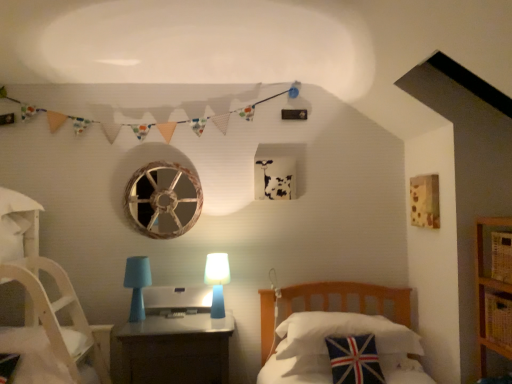
Question: Which direction should I rotate to look at blue matte table lamp at center, positioned as the 1th table lamp in right-to-left order?

Choices:
 (A) left
 (B) right

Answer: (A)

Question: Is matte plastic nightstand at center thinner than yellow woven basket at lower right?

Choices:
 (A) yes
 (B) no

Answer: (B)

Question: Is matte plastic nightstand at center positioned behind yellow woven basket at lower right?

Choices:
 (A) yes
 (B) no

Answer: (A)

Question: Considering the relative sizes of matte plastic nightstand at center and yellow woven basket at lower right in the image provided, is matte plastic nightstand at center shorter than yellow woven basket at lower right?

Choices:
 (A) no
 (B) yes

Answer: (A)

Question: From the image's perspective, is matte plastic nightstand at center over yellow woven basket at lower right?

Choices:
 (A) yes
 (B) no

Answer: (B)

Question: From the image's perspective, is matte plastic nightstand at center under yellow woven basket at lower right?

Choices:
 (A) yes
 (B) no

Answer: (A)

Question: Is matte plastic nightstand at center far from yellow woven basket at lower right?

Choices:
 (A) yes
 (B) no

Answer: (A)

Question: Does satin silver desktop at center have a smaller size compared to union jack fabric pillow at center, which appears as the 1th pillow when viewed from the back?

Choices:
 (A) no
 (B) yes

Answer: (B)

Question: Is union jack fabric pillow at center, which appears as the 1th pillow when viewed from the back, at the back of satin silver desktop at center?

Choices:
 (A) no
 (B) yes

Answer: (A)

Question: From a real-world perspective, is satin silver desktop at center physically above union jack fabric pillow at center, which appears as the 1th pillow when viewed from the back?

Choices:
 (A) no
 (B) yes

Answer: (B)

Question: Is satin silver desktop at center wider than union jack fabric pillow at center, which appears as the 1th pillow when viewed from the back?

Choices:
 (A) yes
 (B) no

Answer: (B)

Question: Is satin silver desktop at center not near union jack fabric pillow at center, which appears as the 1th pillow when viewed from the back?

Choices:
 (A) no
 (B) yes

Answer: (A)

Question: From the image's perspective, would you say satin silver desktop at center is positioned over union jack fabric pillow at center, which is the 2th pillow from front to back?

Choices:
 (A) yes
 (B) no

Answer: (A)

Question: Is yellow woven basket at lower right far away from matte plastic nightstand at center?

Choices:
 (A) no
 (B) yes

Answer: (B)